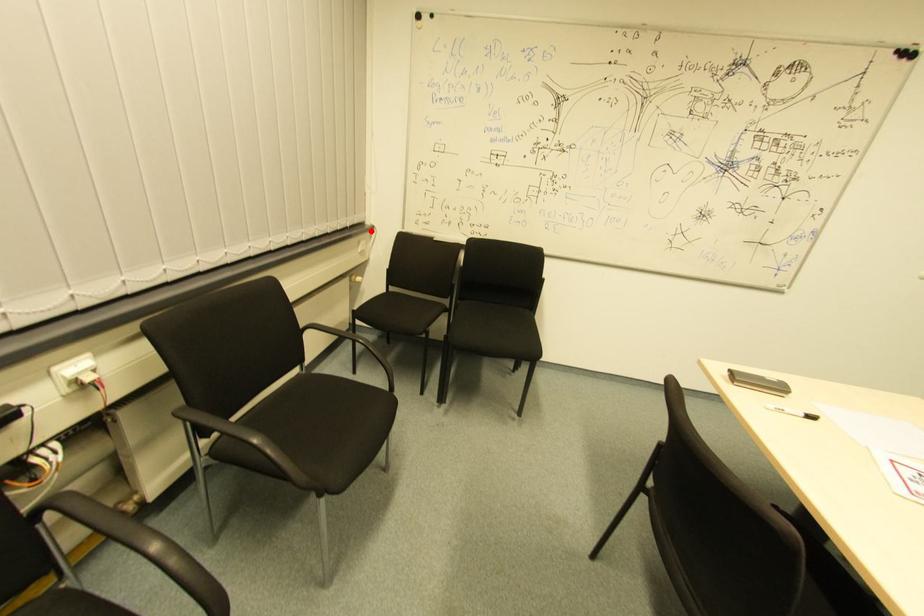
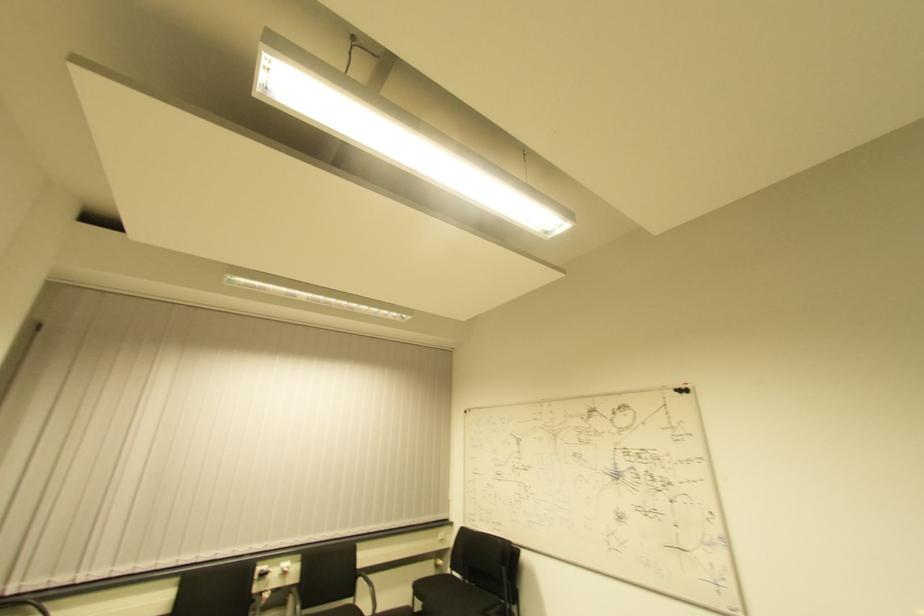
The point at the highlighted location is marked in the first image. Where is the corresponding point in the second image?

(450, 527)